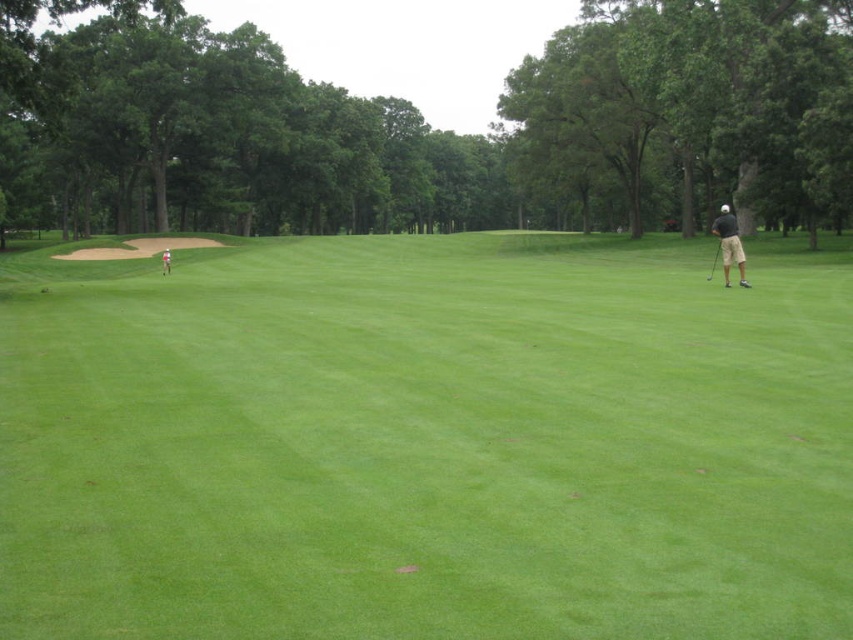
Between green grassy field at center and metallic silver golf club at right, which one is positioned lower?

Positioned lower is green grassy field at center.

This screenshot has height=640, width=853. I want to click on green grassy field at center, so click(x=427, y=442).

Which is more to the left, black fabric golf club at right or metallic silver golf club at right?

metallic silver golf club at right is more to the left.

Can you confirm if black fabric golf club at right is positioned above metallic silver golf club at right?

Correct, black fabric golf club at right is located above metallic silver golf club at right.

The image size is (853, 640). I want to click on black fabric golf club at right, so click(x=729, y=244).

Does dark gray shorts at right have a smaller size compared to metallic silver golf club at right?

Yes, dark gray shorts at right is smaller than metallic silver golf club at right.

Who is higher up, dark gray shorts at right or metallic silver golf club at right?

Positioned higher is dark gray shorts at right.

What do you see at coordinates (165, 260) in the screenshot? This screenshot has height=640, width=853. I see `dark gray shorts at right` at bounding box center [165, 260].

Find the location of `dark gray shorts at right`. dark gray shorts at right is located at coordinates (165, 260).